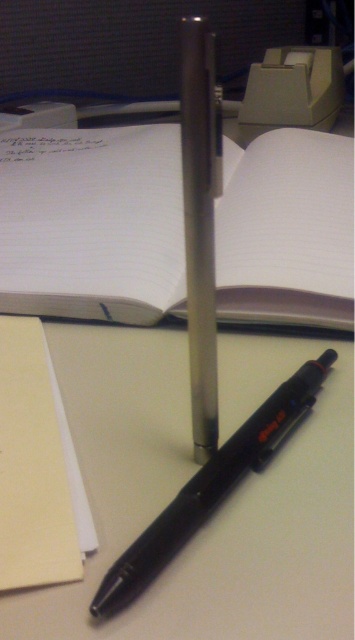
Question: Considering the real-world distances, which object is farthest from the yellow paper at lower left?

Choices:
 (A) black matte pen at center
 (B) white paper notebook at center

Answer: (B)

Question: Which point appears farthest from the camera in this image?

Choices:
 (A) tap(128, 557)
 (B) tap(31, 362)
 (C) tap(276, 317)

Answer: (C)

Question: Can you confirm if yellow paper at lower left is positioned above black matte pen at center?

Choices:
 (A) yes
 (B) no

Answer: (A)

Question: Is white paper notebook at center wider than black matte pen at center?

Choices:
 (A) no
 (B) yes

Answer: (B)

Question: Does yellow paper at lower left appear on the right side of black matte pen at center?

Choices:
 (A) no
 (B) yes

Answer: (A)

Question: Which point is farther to the camera?

Choices:
 (A) white paper notebook at center
 (B) yellow paper at lower left
 (C) black matte pen at center

Answer: (A)